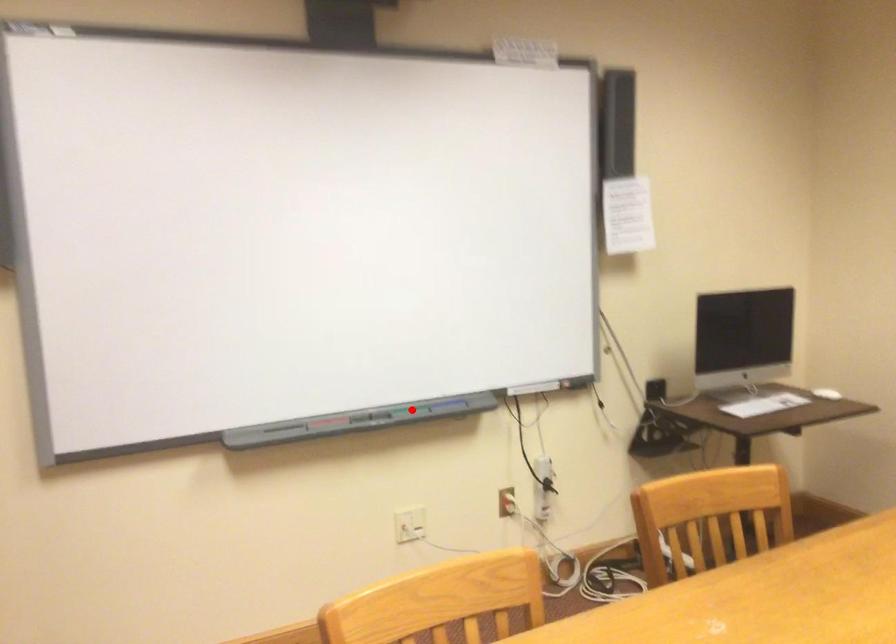
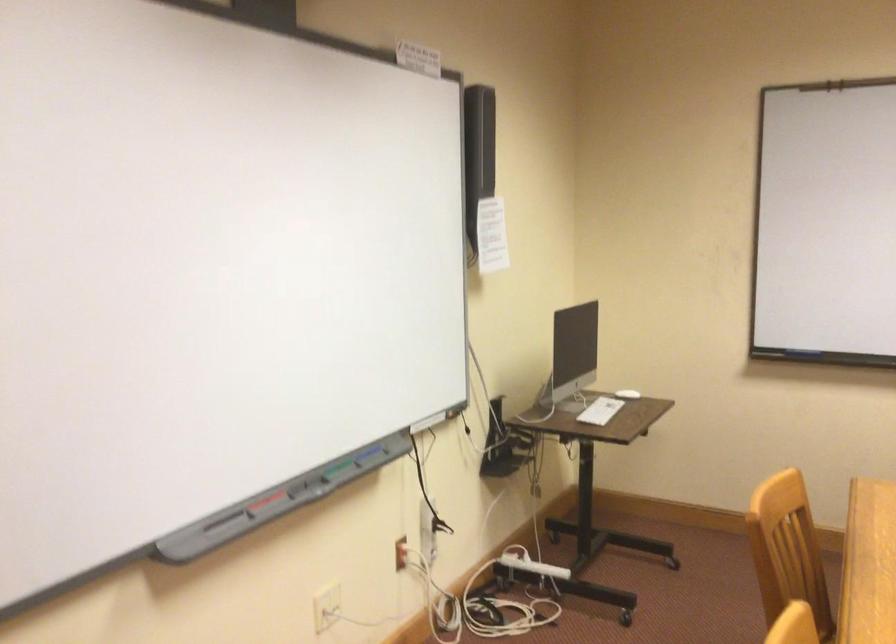
Locate, in the second image, the point that corresponds to the highlighted location in the first image.

(333, 468)